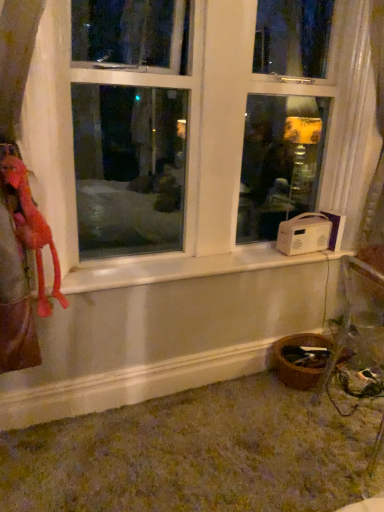
Question: From a real-world perspective, is white sheer curtain at right located beneath white plastic window at center?

Choices:
 (A) no
 (B) yes

Answer: (B)

Question: Considering the relative sizes of white sheer curtain at right and white plastic window at center in the image provided, is white sheer curtain at right smaller than white plastic window at center?

Choices:
 (A) yes
 (B) no

Answer: (A)

Question: Is white sheer curtain at right at the right side of white plastic window at center?

Choices:
 (A) yes
 (B) no

Answer: (A)

Question: Considering the relative sizes of white sheer curtain at right and white plastic window at center in the image provided, is white sheer curtain at right wider than white plastic window at center?

Choices:
 (A) no
 (B) yes

Answer: (B)

Question: Is white sheer curtain at right behind white plastic window at center?

Choices:
 (A) yes
 (B) no

Answer: (A)

Question: Is white sheer curtain at right positioned in front of white plastic window at center?

Choices:
 (A) no
 (B) yes

Answer: (A)

Question: Is the surface of white plastic window at center in direct contact with white sheer curtain at right?

Choices:
 (A) yes
 (B) no

Answer: (B)

Question: Could white sheer curtain at right be considered to be inside white plastic window at center?

Choices:
 (A) no
 (B) yes

Answer: (A)

Question: Does white plastic window at center have a lesser width compared to white sheer curtain at right?

Choices:
 (A) no
 (B) yes

Answer: (B)

Question: Is white plastic window at center bigger than white sheer curtain at right?

Choices:
 (A) yes
 (B) no

Answer: (A)

Question: Is white plastic window at center not within white sheer curtain at right?

Choices:
 (A) no
 (B) yes

Answer: (B)

Question: Is white plastic window at center far from white sheer curtain at right?

Choices:
 (A) yes
 (B) no

Answer: (B)

Question: Is there a large distance between fluffy pink stuffed animal at left and white plastic window at center?

Choices:
 (A) no
 (B) yes

Answer: (A)